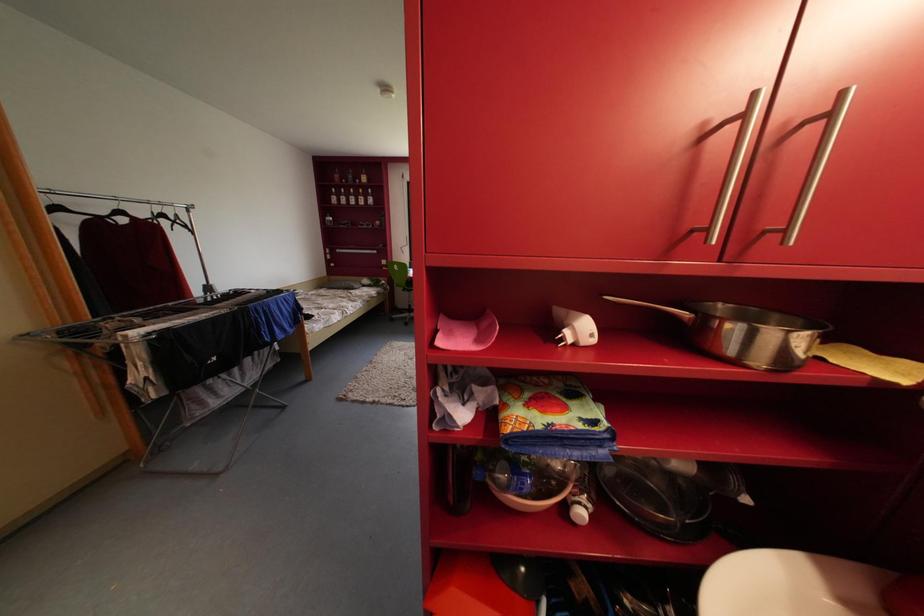
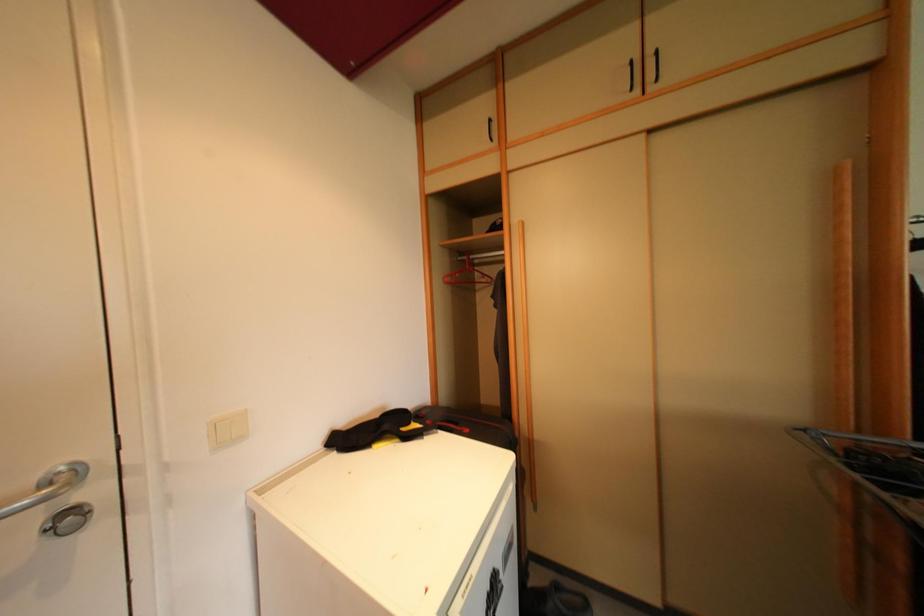
Question: The camera is either moving clockwise (left) or counter-clockwise (right) around the object. The first image is from the beginning of the video and the second image is from the end. Is the camera moving left or right when shooting the video?

Choices:
 (A) Left
 (B) Right

Answer: (B)